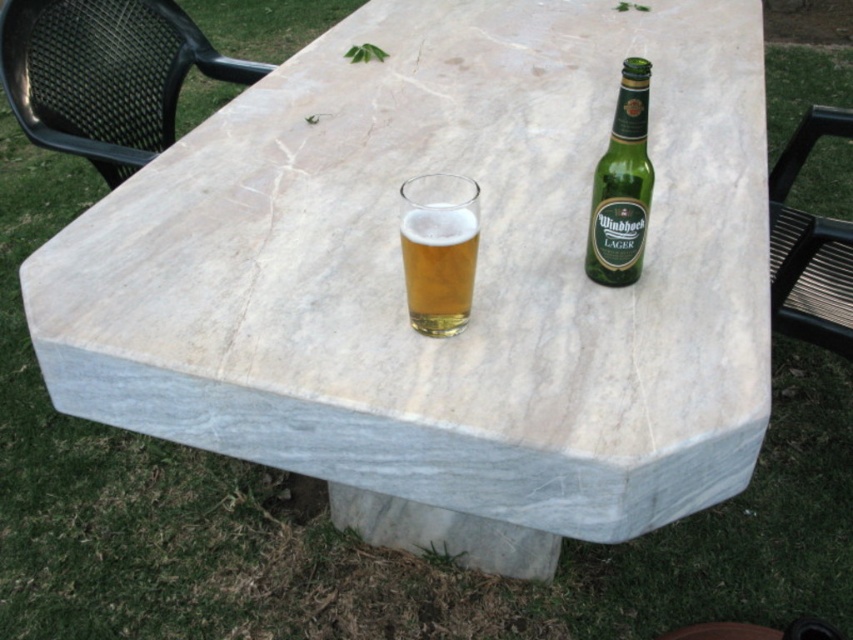
You are standing at the center of the image. Which direction should you look to see the black mesh chair at upper left?

You should look to the upper left direction to see the black mesh chair at upper left as it is located at point [103,76].

You are planning to place a small decorative item on the table. The translucent glass at center and the green glass bottle at upper right are already there. Which object has more space around it for placing the item?

The green glass bottle at upper right has more space around it because it occupies less space than the translucent glass at center.